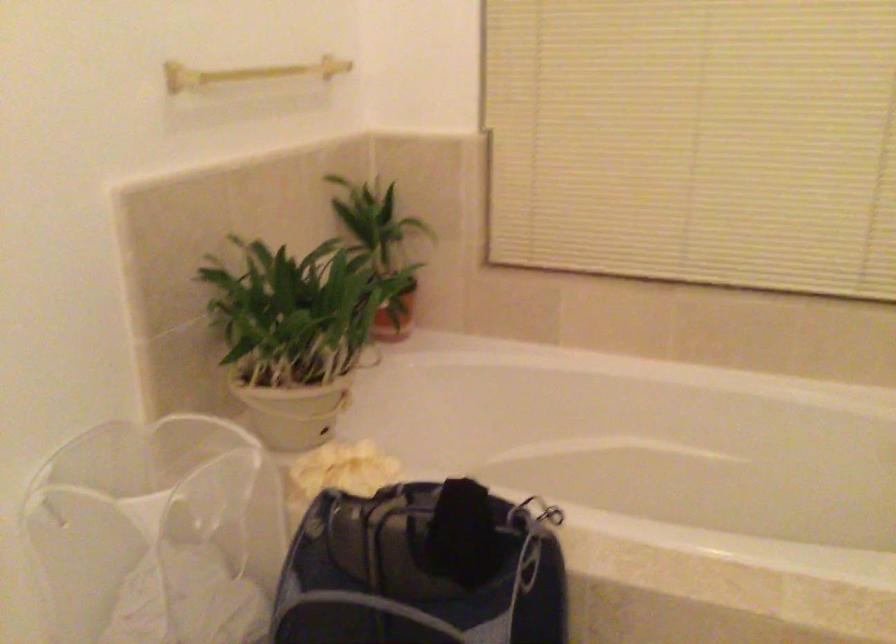
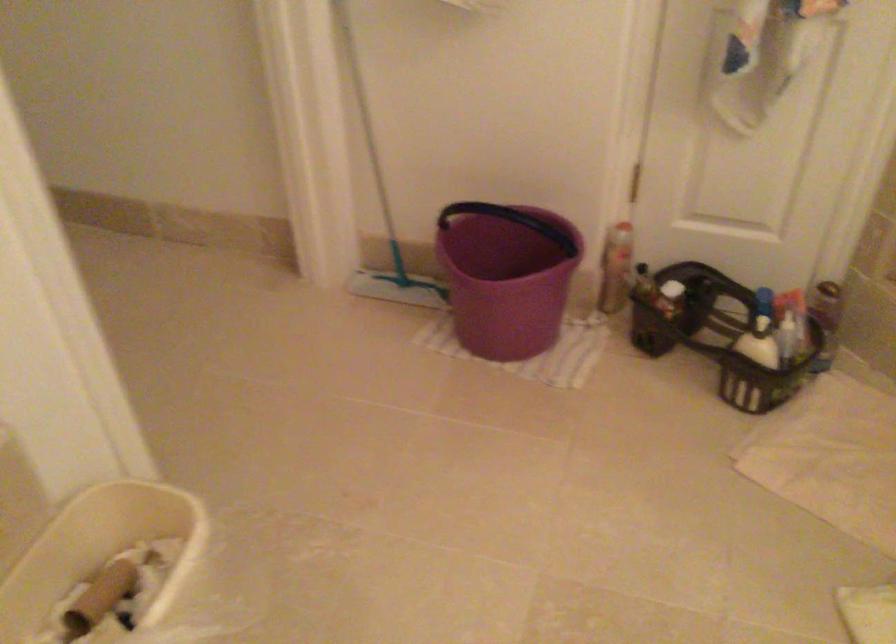
Based on the continuous images, in which direction is the camera rotating?

The rotation direction of the camera is right-down.